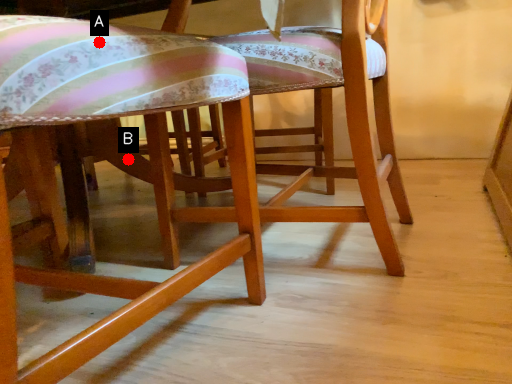
Question: Two points are circled on the image, labeled by A and B beside each circle. Which of the following is the farthest from the observer?

Choices:
 (A) A is further
 (B) B is further

Answer: (B)